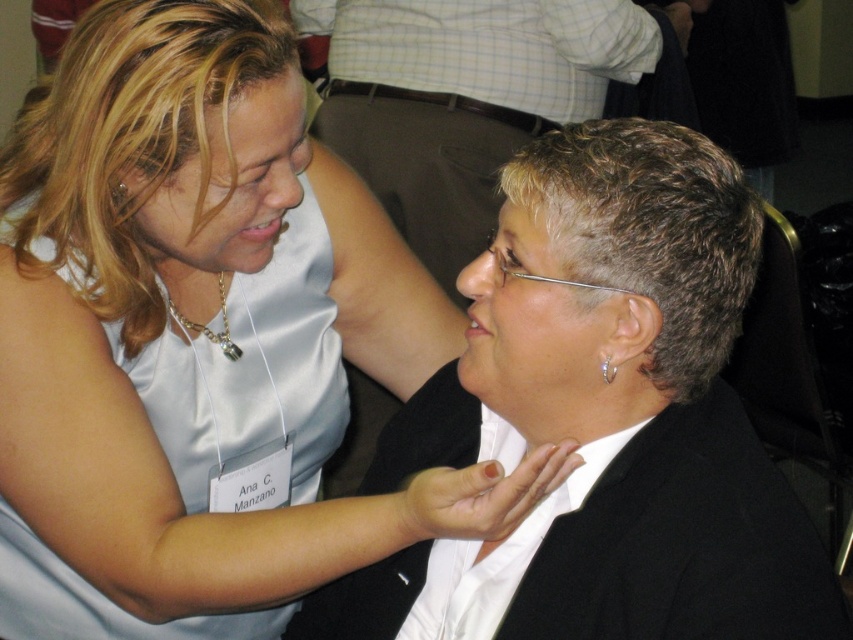
Can you confirm if gray matte hair at center is positioned above satin white dress at upper left?

Indeed, gray matte hair at center is positioned over satin white dress at upper left.

Does gray matte hair at center have a greater width compared to satin white dress at upper left?

Yes.

Find the location of a particular element. This screenshot has height=640, width=853. gray matte hair at center is located at coordinates (462, 97).

Who is positioned more to the left, white satin dress at upper left or silver metallic earring at right ear?

white satin dress at upper left

Which of these two, white satin dress at upper left or silver metallic earring at right ear, stands shorter?

Standing shorter between the two is silver metallic earring at right ear.

Who is more forward, [167,349] or [608,356]?

Positioned in front is point [608,356].

Locate an element on the screen. white satin dress at upper left is located at coordinates (189, 339).

Can you confirm if white glossy shirt at center is thinner than silver metallic earring at right ear?

In fact, white glossy shirt at center might be wider than silver metallic earring at right ear.

Between point (592, 220) and point (602, 365), which one is positioned in front?

Point (592, 220)

Image resolution: width=853 pixels, height=640 pixels. What do you see at coordinates (601, 419) in the screenshot? I see `white glossy shirt at center` at bounding box center [601, 419].

Image resolution: width=853 pixels, height=640 pixels. Find the location of `white glossy shirt at center`. white glossy shirt at center is located at coordinates (601, 419).